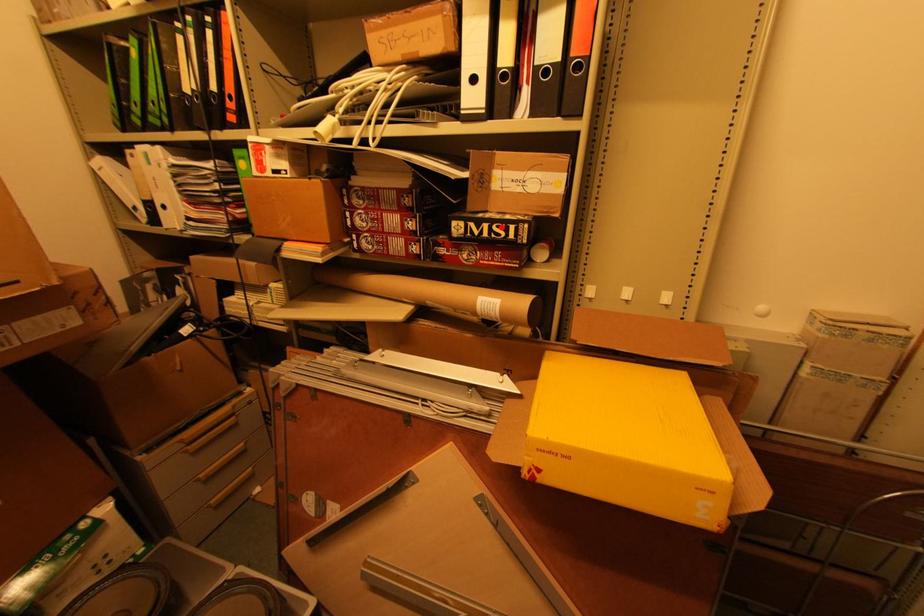
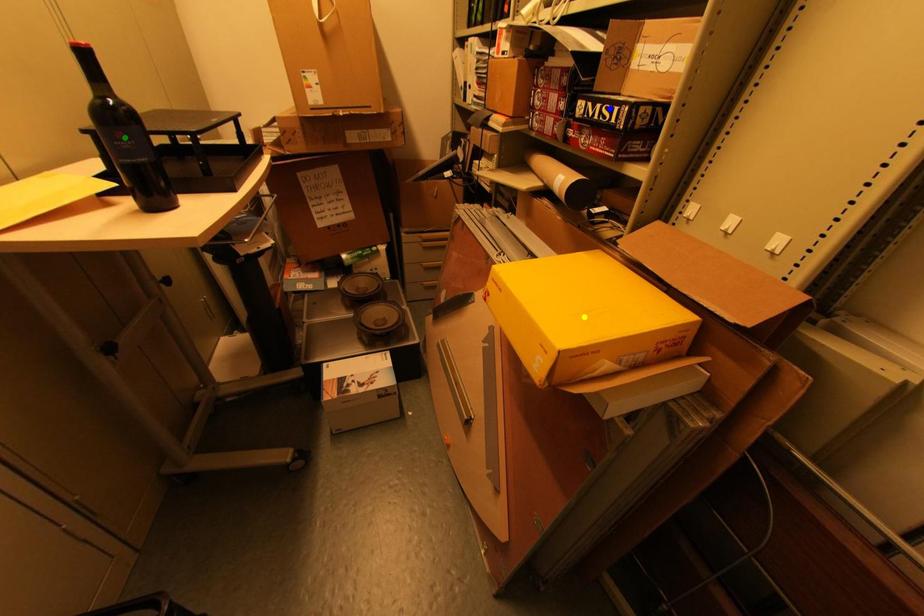
Question: I am providing you with two images of the same scene from different viewpoints. A red point is marked on the first image. You are given multiple points on the second image. In image 2, which mark is for the same physical point as the one in image 1?

Choices:
 (A) blue point
 (B) yellow point
 (C) green point

Answer: (A)